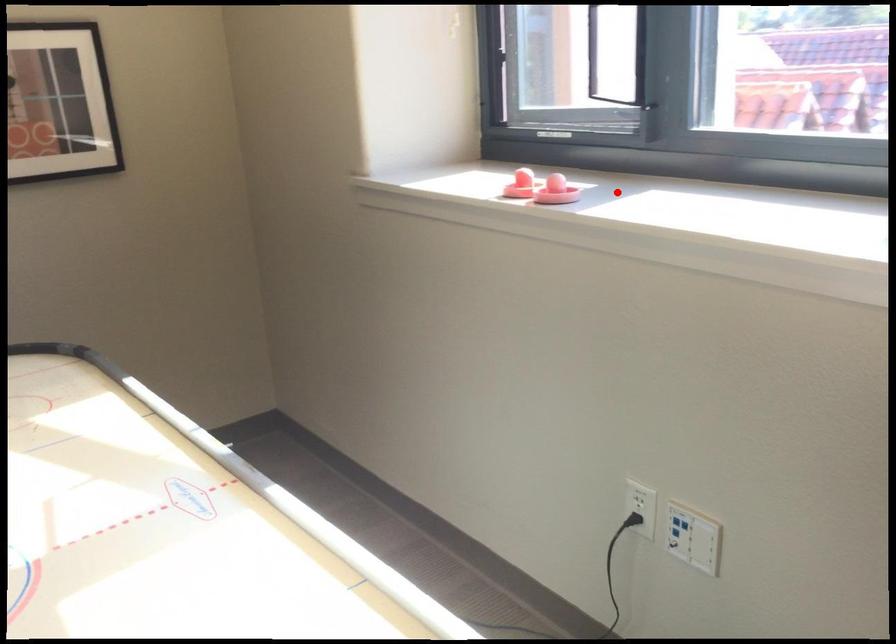
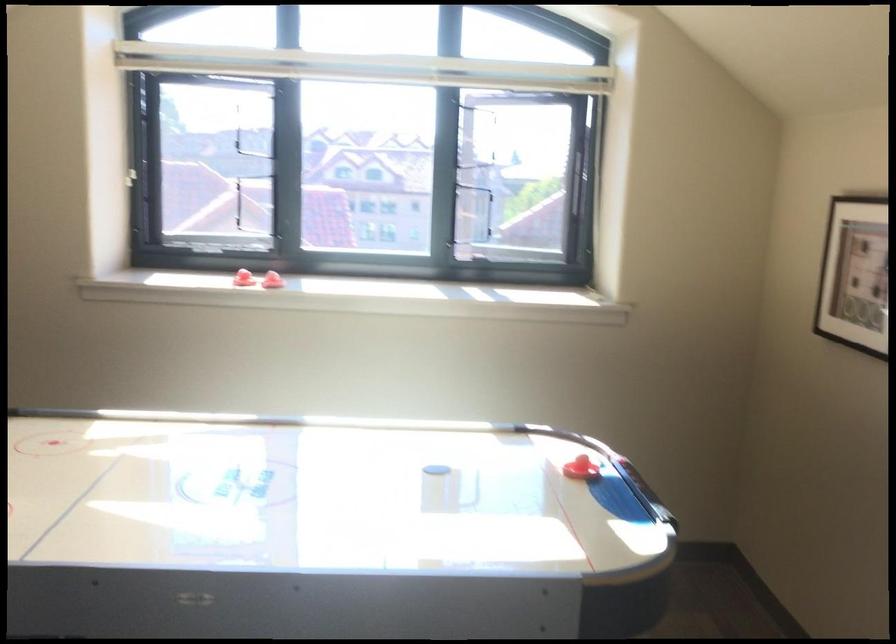
Question: I am providing you with two images of the same scene from different viewpoints. Given a red point in image1, look at the same physical point in image2. Is it:

Choices:
 (A) Closer to the viewpoint
 (B) Farther from the viewpoint

Answer: (B)